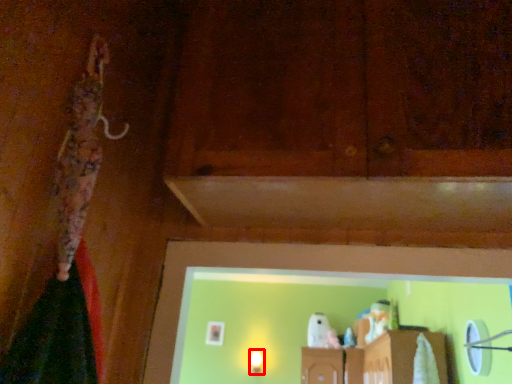
Question: Where is light fixture (annotated by the red box) located in relation to wood in the image?

Choices:
 (A) right
 (B) left

Answer: (B)